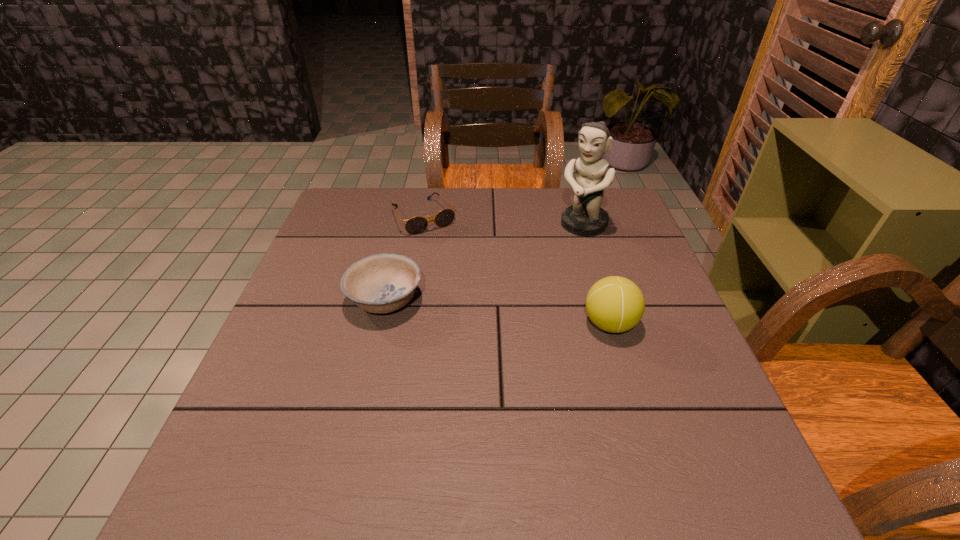
In the image, there is a desktop. Identify the location of vacant space at the left edge. Image resolution: width=960 pixels, height=540 pixels. (263, 373).

The height and width of the screenshot is (540, 960). In the image, there is a desktop. In order to click on vacant region at the right edge in this screenshot , I will do `click(612, 264)`.

Image resolution: width=960 pixels, height=540 pixels. Identify the location of free space at the far left corner. (383, 211).

Image resolution: width=960 pixels, height=540 pixels. Identify the location of vacant space at the near left corner. (245, 446).

Locate an element on the screen. The image size is (960, 540). empty location between the tennis ball and the figurine is located at coordinates (596, 274).

Where is `blank region between the tennis ball and the shortest object`? blank region between the tennis ball and the shortest object is located at coordinates coord(516,271).

You are a GUI agent. You are given a task and a screenshot of the screen. Output one action in this format:
    pyautogui.click(x=<x>, y=<y>)
    Task: Click on the empty space between the tennis ball and the third tallest object
    
    Given the screenshot: What is the action you would take?
    pyautogui.click(x=497, y=312)

In order to click on vacant space that's between the shortest object and the figurine in this screenshot , I will do `click(503, 221)`.

Locate an element on the screen. The width and height of the screenshot is (960, 540). empty space between the tallest object and the third shortest object is located at coordinates (596, 274).

At what (x,y) coordinates should I click in order to perform the action: click on vacant space that is in between the bowl and the figurine. Please return your answer as a coordinate pair (x, y). Looking at the image, I should click on (484, 262).